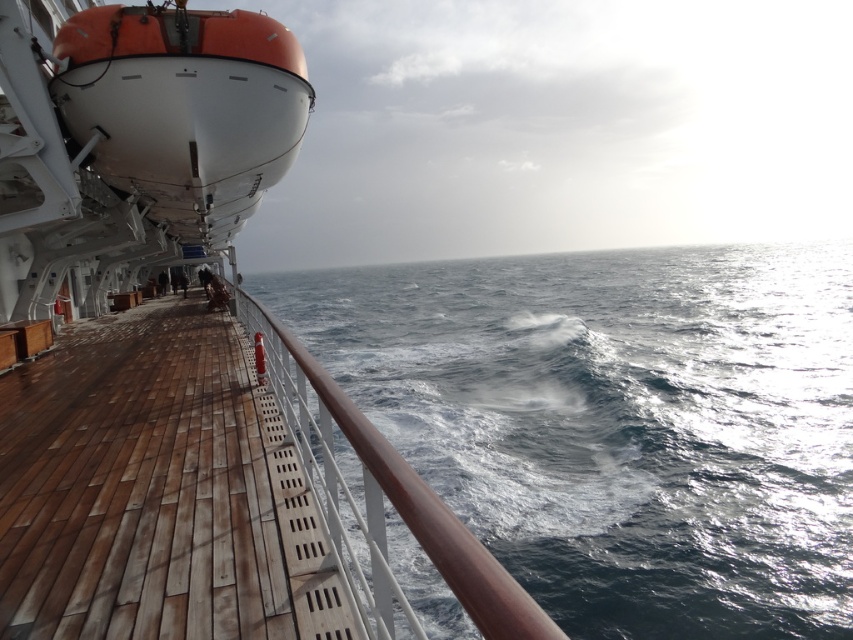
Question: Is orange matte lifeboat at upper left below brown polished wood at center?

Choices:
 (A) no
 (B) yes

Answer: (A)

Question: Among these points, which one is nearest to the camera?

Choices:
 (A) (276, 362)
 (B) (7, 570)

Answer: (B)

Question: Does brown wooden deck at center lie in front of brown polished wood at center?

Choices:
 (A) no
 (B) yes

Answer: (A)

Question: Considering the relative positions of blue water at center and brown wooden deck at center in the image provided, where is blue water at center located with respect to brown wooden deck at center?

Choices:
 (A) above
 (B) below

Answer: (A)

Question: Which point is farther to the camera?

Choices:
 (A) blue water at center
 (B) brown polished wood at center
 (C) brown wooden deck at center
 (D) orange matte lifeboat at upper left

Answer: (A)

Question: Which point is closer to the camera taking this photo?

Choices:
 (A) (804, 531)
 (B) (67, 625)

Answer: (B)